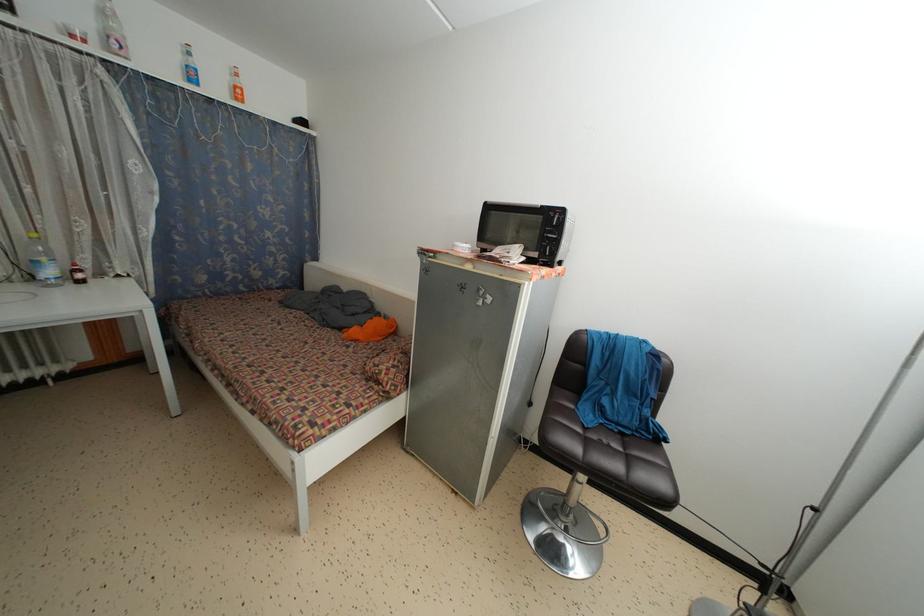
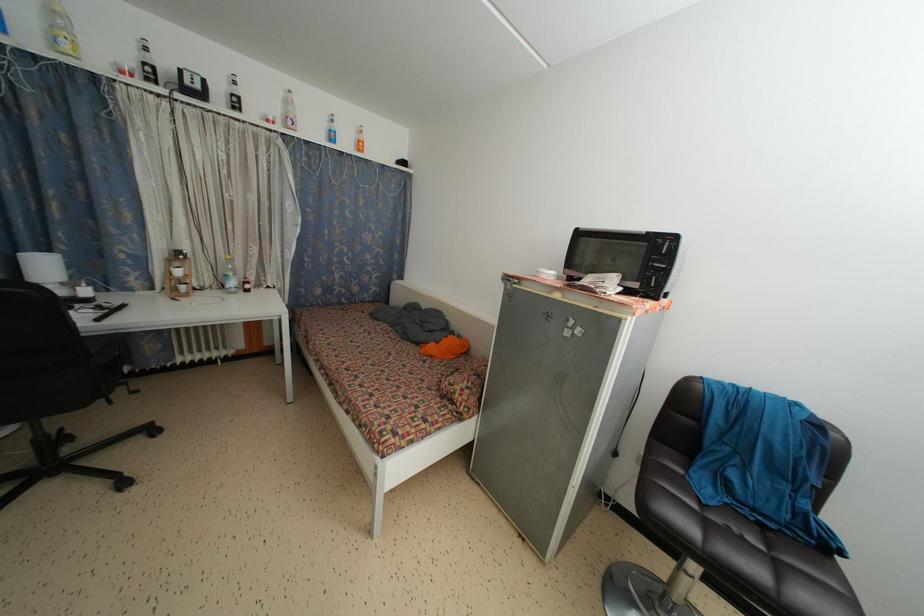
The point at (546, 244) is marked in the first image. Where is the corresponding point in the second image?

(650, 273)